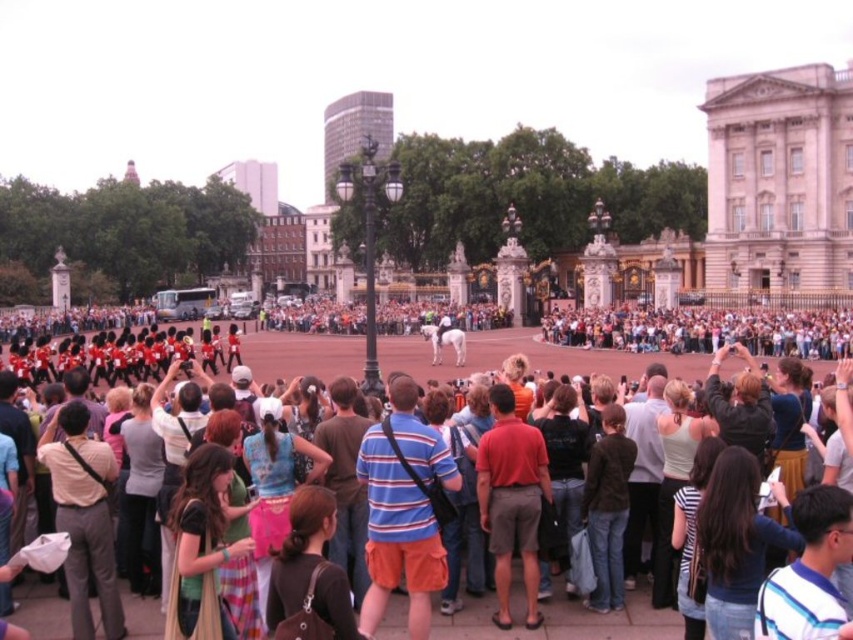
Question: Is dark brown hair at center to the left of black cotton shirt at center from the viewer's perspective?

Choices:
 (A) no
 (B) yes

Answer: (A)

Question: Which object is farther from the camera taking this photo?

Choices:
 (A) brown fabric bag at center
 (B) red cotton shirt at center

Answer: (B)

Question: Can you confirm if light beige pants at center is positioned below light gray tank top at center?

Choices:
 (A) no
 (B) yes

Answer: (B)

Question: Which object is closer to the camera taking this photo?

Choices:
 (A) black cotton shirt at center
 (B) light beige pants at center
 (C) dark brown leather jacket at center

Answer: (B)

Question: Which point is farther to the camera?

Choices:
 (A) light beige pants at center
 (B) dark brown leather jacket at center

Answer: (B)

Question: Does red cotton shirt at center appear on the right side of dark brown leather jacket at center?

Choices:
 (A) no
 (B) yes

Answer: (A)